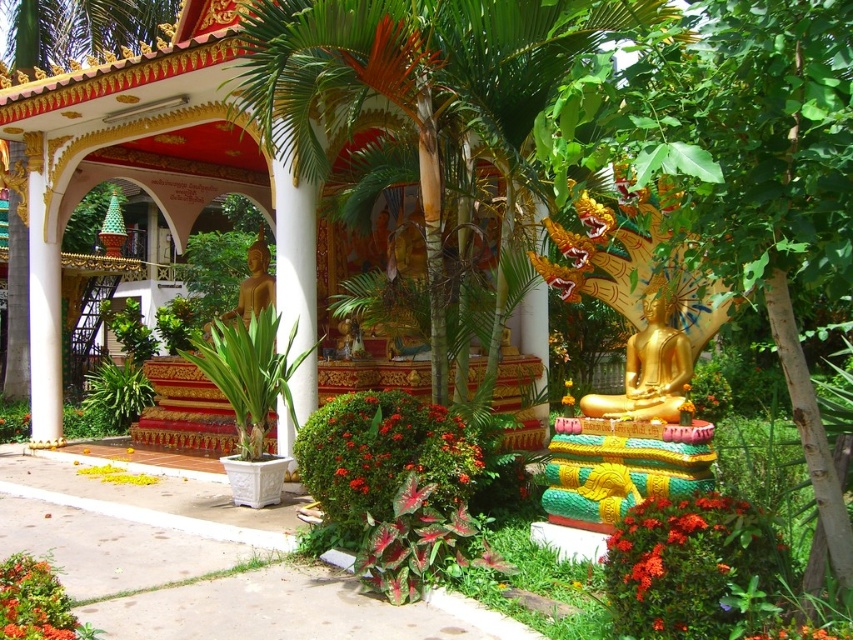
Is bright orange flowers at lower right shorter than gold polished statue at center right?

Yes.

Consider the image. Who is more forward, (664, 545) or (666, 397)?

Point (664, 545)

Measure the distance between point (735, 522) and camera.

4.15 meters

This screenshot has height=640, width=853. I want to click on bright orange flowers at lower right, so click(x=680, y=548).

Can you confirm if green leafy palm tree at center is bigger than gold polished statue at center?

Yes.

From the picture: Is green leafy palm tree at center positioned at the back of gold polished statue at center?

No, it is in front of gold polished statue at center.

The width and height of the screenshot is (853, 640). In order to click on green leafy palm tree at center in this screenshot , I will do `click(418, 100)`.

Does bright orange petals at lower left have a smaller size compared to gold polished statue at center?

No, bright orange petals at lower left is not smaller than gold polished statue at center.

Does bright orange petals at lower left appear on the left side of gold polished statue at center?

No, bright orange petals at lower left is not to the left of gold polished statue at center.

Identify the location of bright orange petals at lower left. This screenshot has width=853, height=640. (x=33, y=602).